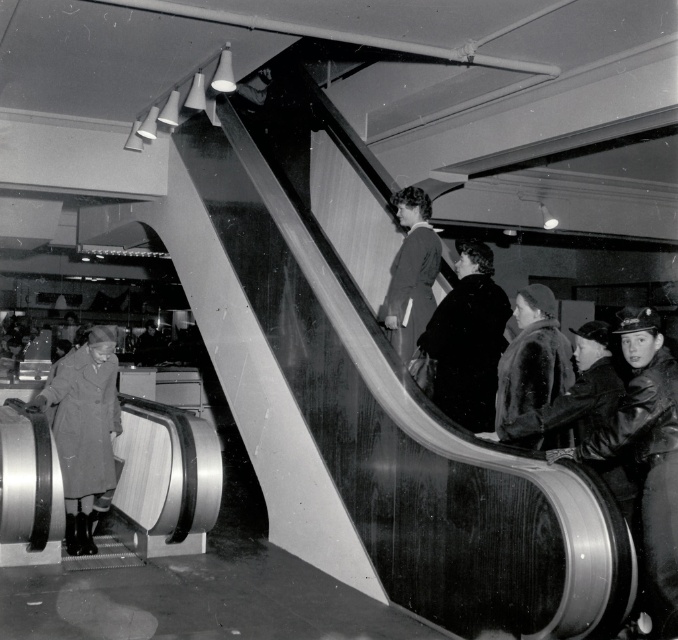
Question: Is leather jacket at right in front of velvet brown coat at center?

Choices:
 (A) yes
 (B) no

Answer: (A)

Question: Among these points, which one is farthest from the camera?

Choices:
 (A) (45, 403)
 (B) (521, 440)
 (C) (418, 269)
 (D) (479, 244)

Answer: (A)

Question: Which object is positioned closest to the velvet brown coat at center?

Choices:
 (A) smooth fabric coat at center
 (B) leather jacket at right

Answer: (B)

Question: Which is farther from the dark wool coat at center?

Choices:
 (A) leather jacket at right
 (B) coated gray coat at left
 (C) smooth fabric coat at center

Answer: (B)

Question: Does coated gray coat at left appear over smooth fabric coat at center?

Choices:
 (A) yes
 (B) no

Answer: (B)

Question: Where is coated gray coat at left located in relation to smooth fabric coat at center in the image?

Choices:
 (A) left
 (B) right

Answer: (A)